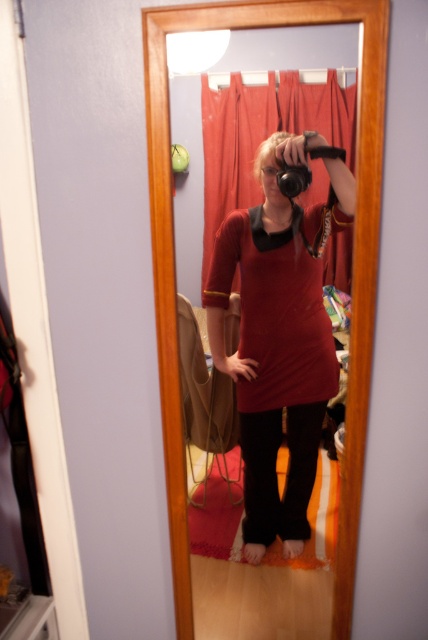
Does red fabric curtain at center appear on the right side of blonde hair at upper center?

No, red fabric curtain at center is not to the right of blonde hair at upper center.

Is red fabric curtain at center behind blonde hair at upper center?

Yes, it is.

Who is more distant from viewer, (204,179) or (264,164)?

The point (204,179) is behind.

The height and width of the screenshot is (640, 428). What are the coordinates of `red fabric curtain at center` in the screenshot? It's located at (261, 134).

Does matte red dress at center have a lesser height compared to red fabric curtain at center?

Incorrect, matte red dress at center's height does not fall short of red fabric curtain at center's.

Can you confirm if matte red dress at center is taller than red fabric curtain at center?

Indeed, matte red dress at center has a greater height compared to red fabric curtain at center.

Who is more forward, (269, 308) or (225, 93)?

Point (269, 308)

The width and height of the screenshot is (428, 640). In order to click on matte red dress at center in this screenshot , I will do `click(275, 355)`.

Which is above, matte wood mirror at center or red fabric curtain at center?

red fabric curtain at center is higher up.

Is matte wood mirror at center shorter than red fabric curtain at center?

Incorrect, matte wood mirror at center's height does not fall short of red fabric curtain at center's.

Between point (335, 637) and point (342, 280), which one is positioned in front?

Point (335, 637) is in front.

I want to click on matte wood mirror at center, so click(353, 257).